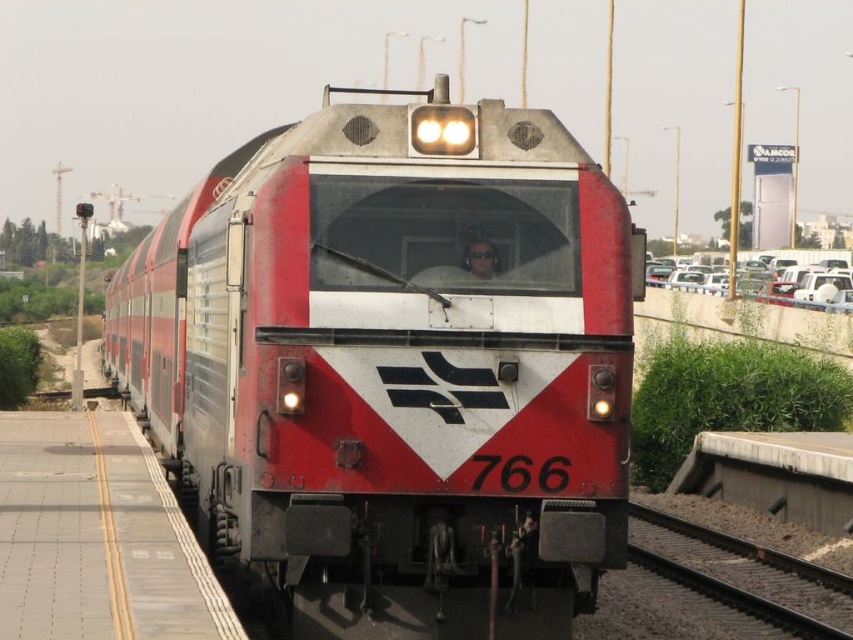
Question: Does metallic red train at center appear under black metal train track at lower right?

Choices:
 (A) no
 (B) yes

Answer: (A)

Question: Which is nearer to the gray concrete platform at lower left?

Choices:
 (A) metallic red train at center
 (B) black metal train track at lower right

Answer: (A)

Question: Is metallic red train at center smaller than gray concrete platform at lower left?

Choices:
 (A) no
 (B) yes

Answer: (A)

Question: Which point appears farthest from the camera in this image?

Choices:
 (A) (741, 589)
 (B) (408, 253)
 (C) (51, 628)

Answer: (A)

Question: Estimate the real-world distances between objects in this image. Which object is farther from the metallic red train at center?

Choices:
 (A) gray concrete platform at lower left
 (B) black metal train track at lower right

Answer: (B)

Question: Is gray concrete platform at lower left above black metal train track at lower right?

Choices:
 (A) no
 (B) yes

Answer: (B)